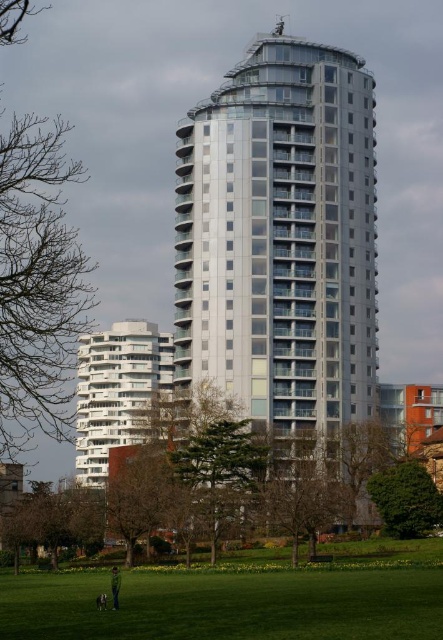
You are standing on the grassy area in front of the highrise building and see the brown textured tree at center and the green fabric jacket at lower center. Which object is higher from the ground?

The brown textured tree at center is located above the green fabric jacket at lower center, so the brown textured tree at center is higher from the ground.

You are standing at the point marked by the coordinates point [283,312]. The building in the scene is 300 feet tall. Can you see the top of the building from your current position?

The point point [283,312] is 374.77 feet away from the viewer. Since the building is 300 feet tall, and the distance is greater than the height, you can see the top of the building from your current position.